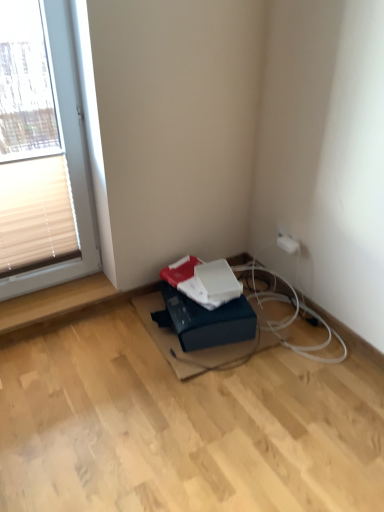
The width and height of the screenshot is (384, 512). I want to click on free spot in front of white matte paperback book at center, so click(x=216, y=312).